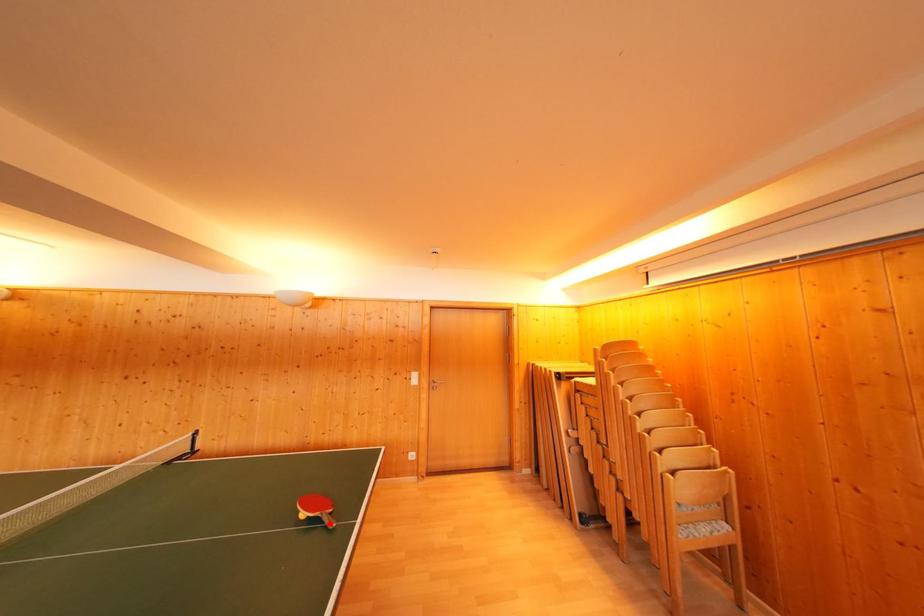
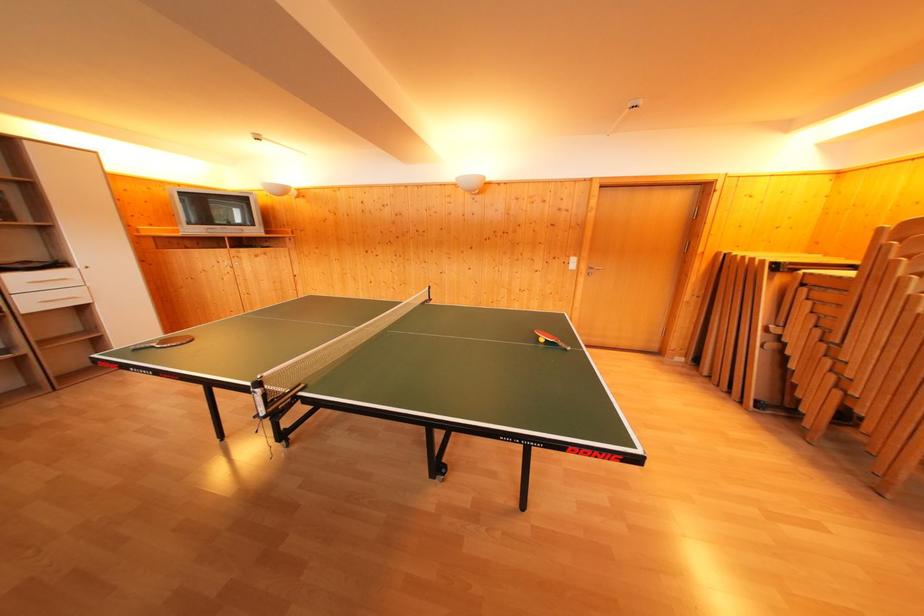
In the second image, find the point that corresponds to the highlighted location in the first image.

(565, 350)